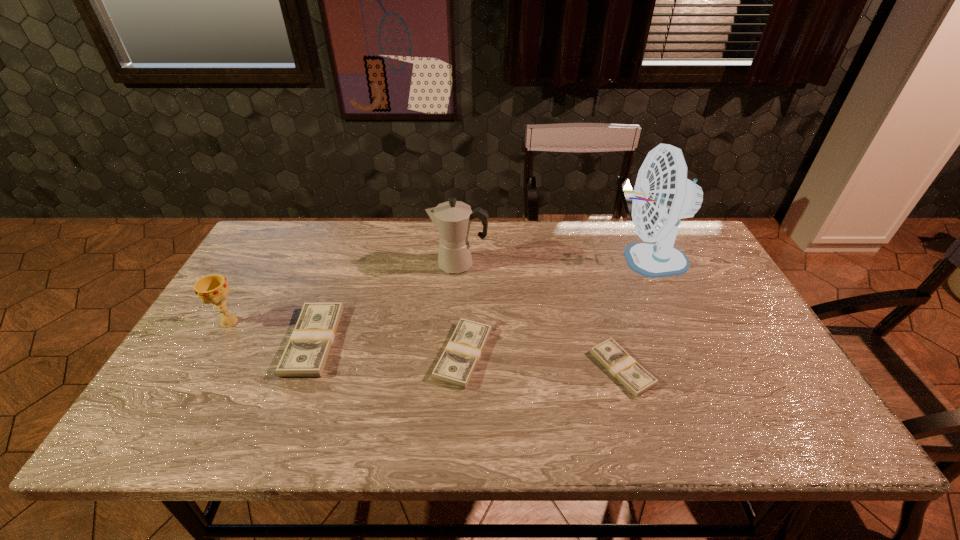
The width and height of the screenshot is (960, 540). Find the location of `vacant space situated on the right of the tallest dollar`. vacant space situated on the right of the tallest dollar is located at coordinates (432, 341).

What are the coordinates of `free region located on the right of the second dollar from left to right` in the screenshot? It's located at (645, 354).

Identify the location of vacant space located on the right of the shortest object. Image resolution: width=960 pixels, height=540 pixels. (726, 368).

Find the location of a particular element. This screenshot has height=540, width=960. free space located on the grille of the tallest object is located at coordinates (523, 260).

This screenshot has height=540, width=960. I want to click on vacant space located 0.060m on the grille of the tallest object, so click(x=584, y=260).

Locate an element on the screen. free space located 0.190m on the grille of the tallest object is located at coordinates (542, 260).

Where is `vacant space located 0.330m on the front of the second tallest object`? The image size is (960, 540). vacant space located 0.330m on the front of the second tallest object is located at coordinates (453, 364).

Where is `free location located on the right of the fourth shortest object`? This screenshot has height=540, width=960. free location located on the right of the fourth shortest object is located at coordinates (296, 322).

Where is `fan at the far edge`? This screenshot has height=540, width=960. fan at the far edge is located at coordinates (662, 195).

Where is `coffeepot present at the far edge`? coffeepot present at the far edge is located at coordinates [x=452, y=219].